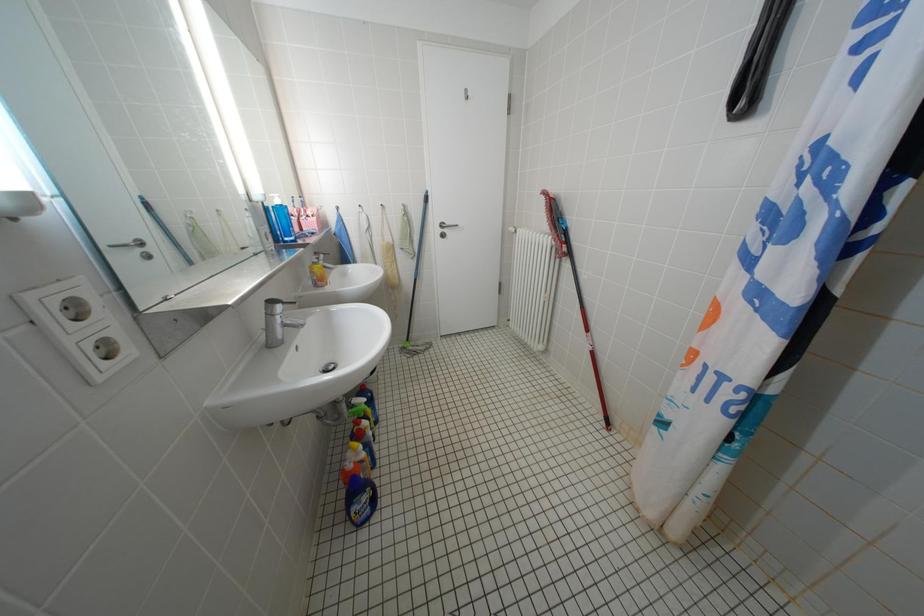
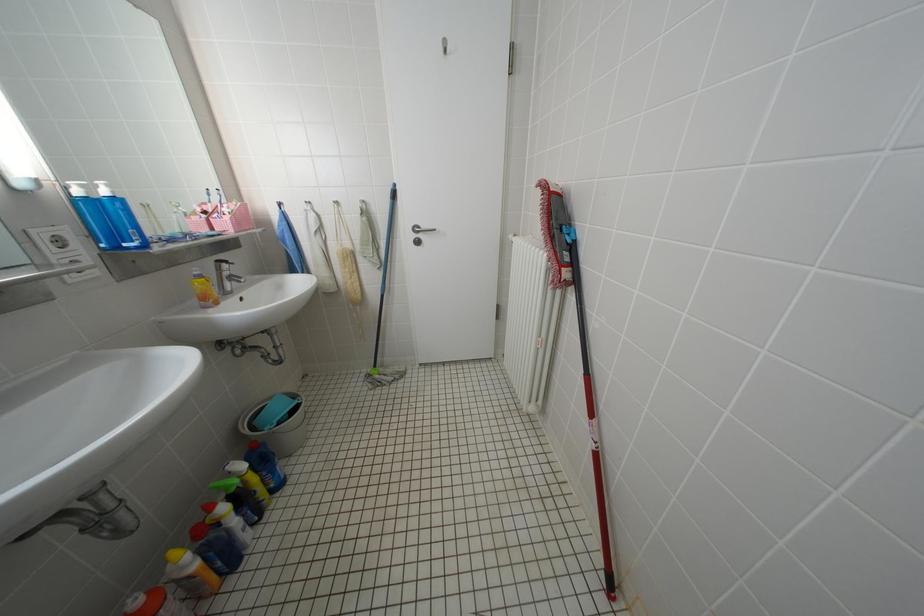
Question: The first image is from the beginning of the video and the second image is from the end. How did the camera likely rotate when shooting the video?

Choices:
 (A) Left
 (B) Right
 (C) Up
 (D) Down

Answer: (A)